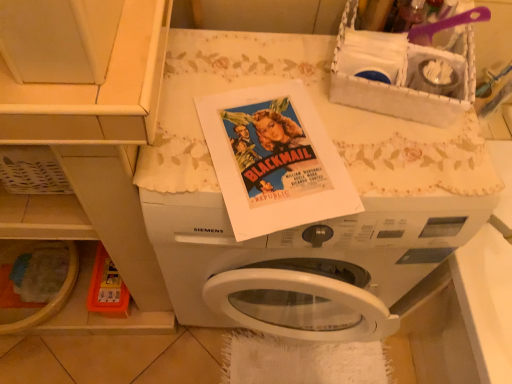
What is the approximate height of white matte washing machine at center?

white matte washing machine at center is 33.50 inches in height.

Describe the element at coordinates (343, 161) in the screenshot. I see `white matte washing machine at center` at that location.

The width and height of the screenshot is (512, 384). I want to click on white matte washing machine at center, so click(x=343, y=161).

What do you see at coordinates (401, 74) in the screenshot? Image resolution: width=512 pixels, height=384 pixels. I see `white woven basket at upper right` at bounding box center [401, 74].

What is the approximate width of white woven basket at upper right?

9.93 inches.

Identify the location of white woven basket at upper right. (401, 74).

Measure the distance between white woven basket at upper right and camera.

white woven basket at upper right and camera are 27.95 inches apart from each other.

This screenshot has height=384, width=512. Find the location of `white matte washing machine at center`. white matte washing machine at center is located at coordinates (343, 161).

Is white matte washing machine at center to the right of white woven basket at upper right from the viewer's perspective?

No, white matte washing machine at center is not to the right of white woven basket at upper right.

Considering the relative positions of white matte washing machine at center and white woven basket at upper right in the image provided, is white matte washing machine at center behind white woven basket at upper right?

Yes, the depth of white matte washing machine at center is greater than that of white woven basket at upper right.

Considering the points (403, 185) and (361, 35), which point is behind, point (403, 185) or point (361, 35)?

Point (361, 35)

From the image's perspective, which is below, white matte washing machine at center or white woven basket at upper right?

white matte washing machine at center appears lower in the image.

From a real-world perspective, does white matte washing machine at center stand above white woven basket at upper right?

No, from a real-world perspective, white matte washing machine at center is not on top of white woven basket at upper right.

Between white matte washing machine at center and white woven basket at upper right, which one has larger width?

white matte washing machine at center is wider.

Is white matte washing machine at center taller than white woven basket at upper right?

Correct, white matte washing machine at center is much taller as white woven basket at upper right.

Does white matte washing machine at center have a smaller size compared to white woven basket at upper right?

No, white matte washing machine at center is not smaller than white woven basket at upper right.

Is white matte washing machine at center spatially inside white woven basket at upper right, or outside of it?

white matte washing machine at center is not enclosed by white woven basket at upper right.

Is white matte washing machine at center with white woven basket at upper right?

No, white matte washing machine at center is not touching white woven basket at upper right.

Is white matte washing machine at center looking in the opposite direction of white woven basket at upper right?

That's not correct — white matte washing machine at center is not looking away from white woven basket at upper right.

Can you tell me how much white matte washing machine at center and white woven basket at upper right differ in facing direction?

There is a 13.8-degree angle between the facing directions of white matte washing machine at center and white woven basket at upper right.

Identify the location of washing machine behind the white woven basket at upper right. Image resolution: width=512 pixels, height=384 pixels. (343, 161).

Is white woven basket at upper right at the right side of white matte washing machine at center?

Indeed, white woven basket at upper right is positioned on the right side of white matte washing machine at center.

Which is behind, white woven basket at upper right or white matte washing machine at center?

white matte washing machine at center is behind.

Is point (403, 40) farther from viewer compared to point (260, 45)?

No.

From the image's perspective, which object appears higher, white woven basket at upper right or white matte washing machine at center?

white woven basket at upper right appears higher in the image.

From a real-world perspective, who is located higher, white woven basket at upper right or white matte washing machine at center?

white woven basket at upper right.

In terms of width, does white woven basket at upper right look wider or thinner when compared to white matte washing machine at center?

In the image, white woven basket at upper right appears to be more narrow than white matte washing machine at center.

Considering the sizes of objects white woven basket at upper right and white matte washing machine at center in the image provided, who is shorter, white woven basket at upper right or white matte washing machine at center?

With less height is white woven basket at upper right.

Considering the sizes of white woven basket at upper right and white matte washing machine at center in the image, is white woven basket at upper right bigger or smaller than white matte washing machine at center?

Considering their sizes, white woven basket at upper right takes up less space than white matte washing machine at center.

Is white woven basket at upper right inside or outside of white matte washing machine at center?

white woven basket at upper right lies outside white matte washing machine at center.

Is white woven basket at upper right in contact with white matte washing machine at center?

No, white woven basket at upper right is not next to white matte washing machine at center.

Is white woven basket at upper right oriented away from white matte washing machine at center?

No.

Measure the distance between white woven basket at upper right and white matte washing machine at center.

white woven basket at upper right is 7.95 inches from white matte washing machine at center.

Identify the location of basket on the right of white matte washing machine at center. This screenshot has width=512, height=384. (401, 74).

Where is `basket located in front of the white matte washing machine at center`? basket located in front of the white matte washing machine at center is located at coordinates (401, 74).

At what (x,y) coordinates should I click in order to perform the action: click on basket above the white matte washing machine at center (from a real-world perspective). Please return your answer as a coordinate pair (x, y). Looking at the image, I should click on (401, 74).